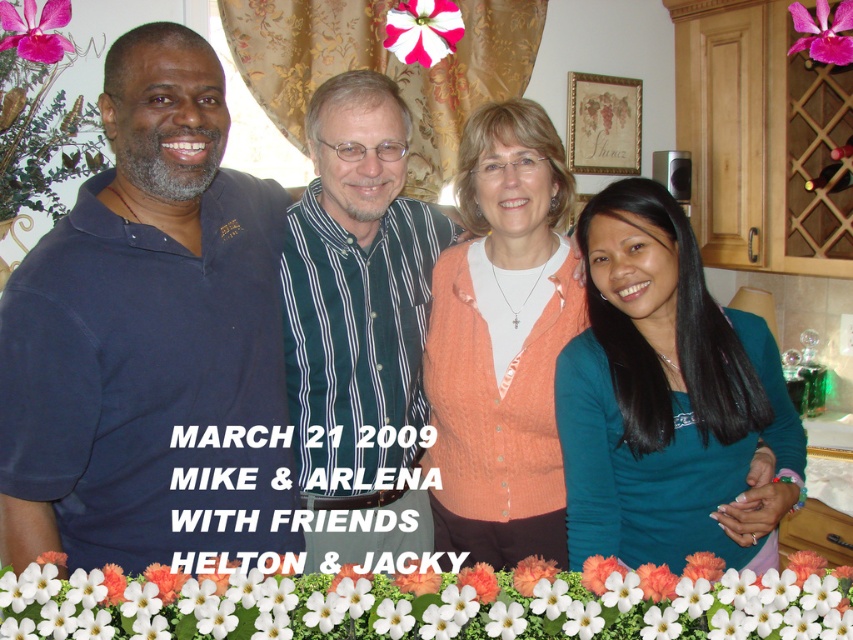
In the scene shown: Can you confirm if teal matte shirt at center is taller than white matte flower at lower center?

Indeed, teal matte shirt at center has a greater height compared to white matte flower at lower center.

Which of these two, teal matte shirt at center or white matte flower at lower center, stands shorter?

white matte flower at lower center is shorter.

Find the location of a particular element. The height and width of the screenshot is (640, 853). teal matte shirt at center is located at coordinates (664, 396).

The height and width of the screenshot is (640, 853). In order to click on teal matte shirt at center in this screenshot , I will do `click(664, 396)`.

Measure the distance between orange knitted cardigan at center and camera.

The distance of orange knitted cardigan at center from camera is 5.16 feet.

Which is in front, point (537, 195) or point (407, 20)?

Point (537, 195) is in front.

Is point (531, 336) positioned in front of point (419, 49)?

Yes, it is.

At what (x,y) coordinates should I click in order to perform the action: click on orange knitted cardigan at center. Please return your answer as a coordinate pair (x, y). This screenshot has height=640, width=853. Looking at the image, I should click on (502, 342).

Does point (326, 440) come behind point (440, 579)?

Yes, it is.

Identify the location of green striped shirt at center. (358, 326).